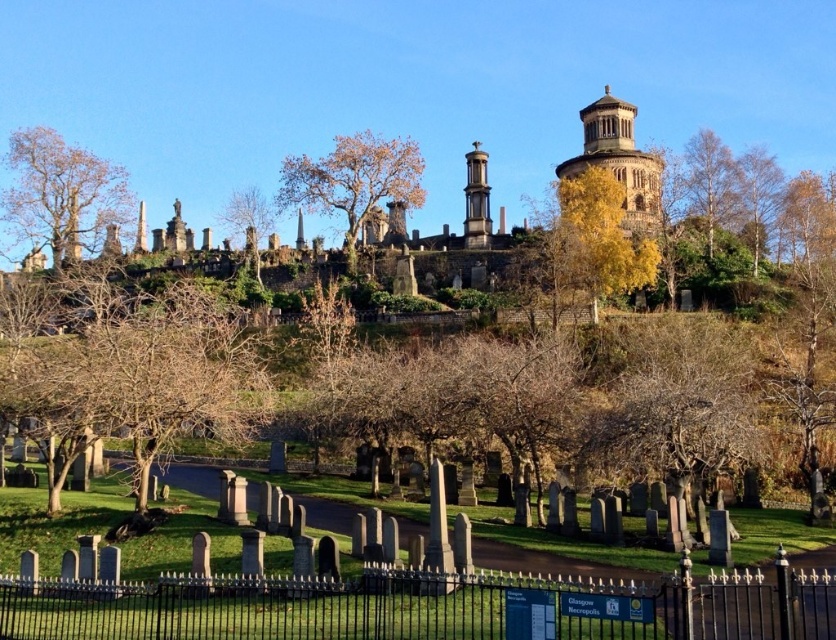
You are a visitor at the cemetery and want to take a photo of both the bare wood tree at upper left and the smooth stone tower at center. Which object should you focus on first to ensure both are in frame?

The bare wood tree at upper left is taller than the smooth stone tower at center, so you should focus on the bare wood tree at upper left first to ensure both are in frame.

You are a gardener who needs to water both the brown leafy tree at center and the smooth stone tower at center. Your hose can reach up to 7 meters. Can you water both without moving the hose? Please explain your reasoning.

The distance between the brown leafy tree at center and the smooth stone tower at center is 7.64 meters. Since the hose can only reach up to 7 meters, you cannot water both without moving the hose because the distance exceeds the hose length.